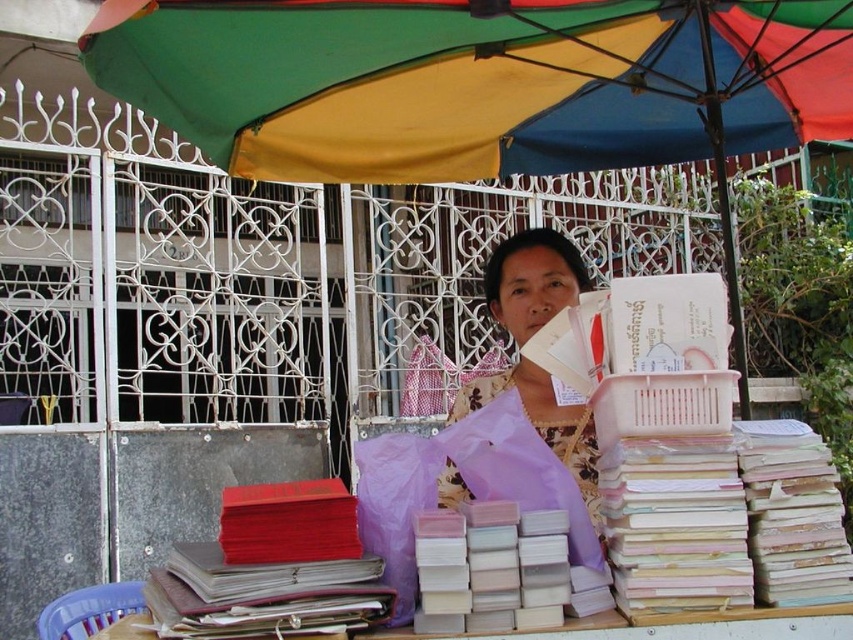
In the scene shown: Which of these two, multicolored fabric umbrella at upper center or wooden table at lower center, stands shorter?

wooden table at lower center is shorter.

Where is `multicolored fabric umbrella at upper center`? Image resolution: width=853 pixels, height=640 pixels. multicolored fabric umbrella at upper center is located at coordinates (474, 81).

Which is behind, point (328, 45) or point (482, 531)?

The point (328, 45) is behind.

Does multicolored fabric umbrella at upper center lie behind white matte book at center?

Yes, it is.

Who is more forward, (558,80) or (492,547)?

Point (492,547) is in front.

At what (x,y) coordinates should I click in order to perform the action: click on multicolored fabric umbrella at upper center. Please return your answer as a coordinate pair (x, y). This screenshot has width=853, height=640. Looking at the image, I should click on (474, 81).

Does pastel paper stack at center appear on the left side of wooden table at lower center?

In fact, pastel paper stack at center is to the right of wooden table at lower center.

Locate an element on the screen. The height and width of the screenshot is (640, 853). pastel paper stack at center is located at coordinates tap(724, 518).